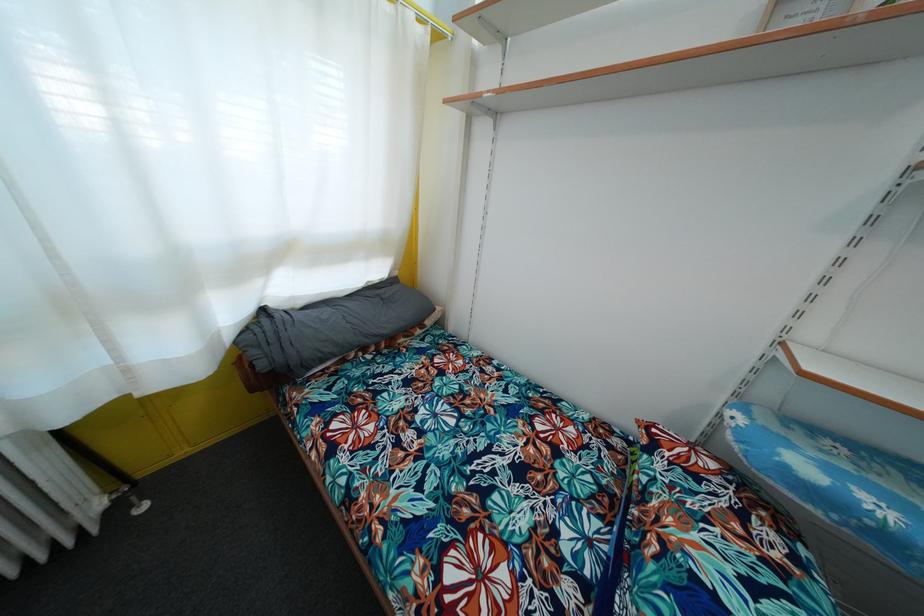
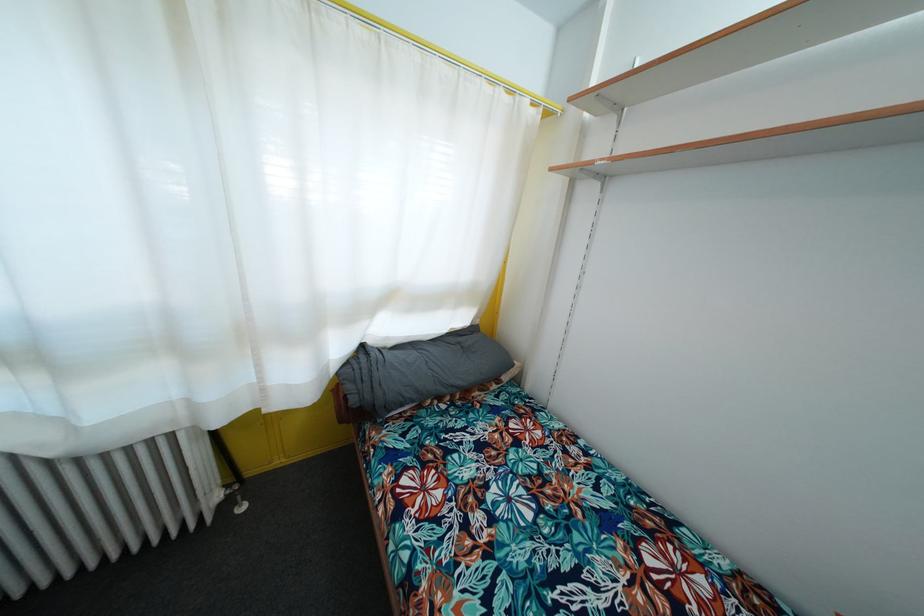
Question: The images are taken continuously from a first-person perspective. In which direction is your viewpoint rotating?

Choices:
 (A) Left
 (B) Right
 (C) Up
 (D) Down

Answer: (A)